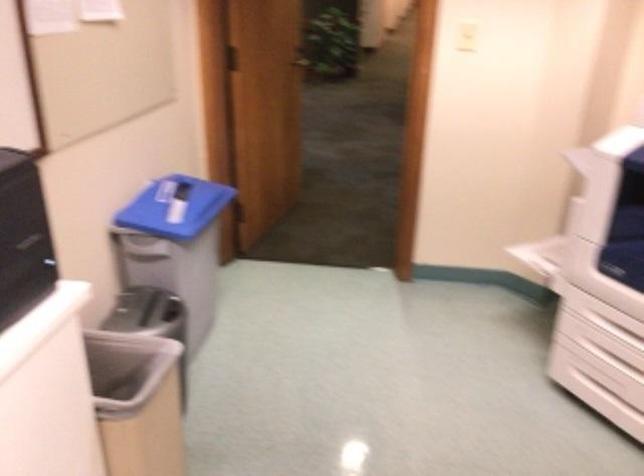
Image resolution: width=644 pixels, height=476 pixels. Describe the element at coordinates (538, 255) in the screenshot. I see `the printer output tray` at that location.